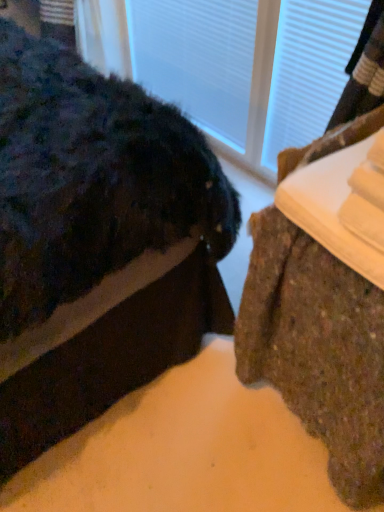
Question: From a real-world perspective, is transparent glass door at upper center on brown textured rug at lower right, the 2th furniture positioned from the right?

Choices:
 (A) yes
 (B) no

Answer: (B)

Question: Can you confirm if transparent glass door at upper center is thinner than brown textured rug at lower right, the 1th furniture when ordered from left to right?

Choices:
 (A) no
 (B) yes

Answer: (B)

Question: Can you see transparent glass door at upper center touching brown textured rug at lower right, the 1th furniture when ordered from left to right?

Choices:
 (A) no
 (B) yes

Answer: (A)

Question: From the image's perspective, is transparent glass door at upper center located above brown textured rug at lower right, the 2th furniture positioned from the right?

Choices:
 (A) no
 (B) yes

Answer: (B)

Question: Can you confirm if transparent glass door at upper center is positioned to the right of brown textured rug at lower right, the 2th furniture positioned from the right?

Choices:
 (A) yes
 (B) no

Answer: (A)

Question: From the image's perspective, is brown textured rug at lower right, marked as the 1th furniture in a right-to-left arrangement, located above or below brown textured rug at lower right, the 2th furniture positioned from the right?

Choices:
 (A) above
 (B) below

Answer: (B)

Question: Considering the positions of brown textured rug at lower right, marked as the 1th furniture in a right-to-left arrangement, and brown textured rug at lower right, the 1th furniture when ordered from left to right, in the image, is brown textured rug at lower right, marked as the 1th furniture in a right-to-left arrangement, bigger or smaller than brown textured rug at lower right, the 1th furniture when ordered from left to right,?

Choices:
 (A) big
 (B) small

Answer: (B)

Question: Considering the positions of brown textured rug at lower right, the second furniture when ordered from left to right, and brown textured rug at lower right, the 2th furniture positioned from the right, in the image, is brown textured rug at lower right, the second furniture when ordered from left to right, taller or shorter than brown textured rug at lower right, the 2th furniture positioned from the right,?

Choices:
 (A) tall
 (B) short

Answer: (B)

Question: Is brown textured rug at lower right, the second furniture when ordered from left to right, spatially inside brown textured rug at lower right, the 2th furniture positioned from the right, or outside of it?

Choices:
 (A) inside
 (B) outside

Answer: (B)

Question: Considering their positions, is transparent glass door at upper center located in front of or behind brown textured rug at lower right, the second furniture when ordered from left to right?

Choices:
 (A) front
 (B) behind

Answer: (B)

Question: Based on their positions, is transparent glass door at upper center located to the left or right of brown textured rug at lower right, the second furniture when ordered from left to right?

Choices:
 (A) left
 (B) right

Answer: (A)

Question: Is point (344, 7) closer or farther from the camera than point (334, 327)?

Choices:
 (A) farther
 (B) closer

Answer: (A)

Question: Is transparent glass door at upper center wider or thinner than brown textured rug at lower right, the second furniture when ordered from left to right?

Choices:
 (A) wide
 (B) thin

Answer: (B)

Question: Which is correct: brown textured rug at lower right, the second furniture when ordered from left to right, is inside transparent glass door at upper center, or outside of it?

Choices:
 (A) outside
 (B) inside

Answer: (A)

Question: Looking at the image, does brown textured rug at lower right, marked as the 1th furniture in a right-to-left arrangement, seem bigger or smaller compared to transparent glass door at upper center?

Choices:
 (A) big
 (B) small

Answer: (A)